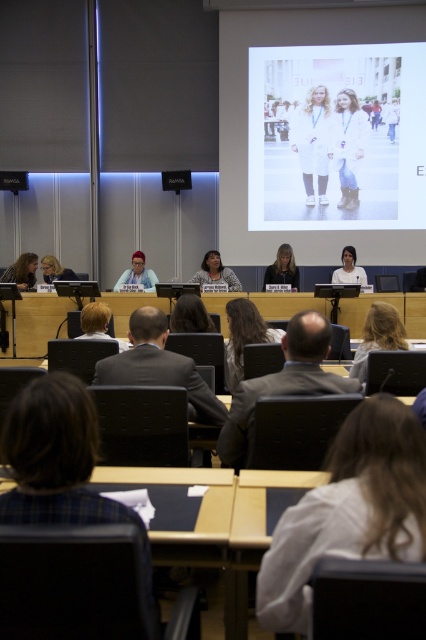
From the picture: You are a photographer setting up for a conference. You need to position a light between the two points, point (19, 288) and point (66, 272). Which point should the light be closer to to ensure it illuminates the panelists effectively?

The light should be placed closer to point (19, 288) because it is closer to the camera, likely near the front of the stage where the panelists are positioned, ensuring better illumination.

You are an attendee at the conference and want to take a photo of the speaker with matte black hair at lower left. Where should you position yourself to capture their hair in the frame?

The matte black hair at lower left is located at point (22, 272), so position yourself near the lower left area of the frame to capture their hair in the photo.

You are an attendee at this meeting and want to approach the panelists. You see the white leather boots at center and the matte black hair at lower left. Which object is closer to the panelists? Please explain your reasoning based on their positions in the scene.

The white leather boots at center is positioned on the right side of matte black hair at lower left, which suggests that the white leather boots at center is closer to the panelists since it is centrally located in the scene where the panelists are positioned. The matte black hair at lower left is positioned further away from the panelists compared to the white leather boots at center.